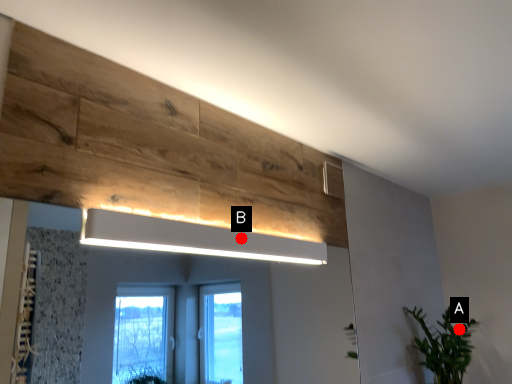
Question: Two points are circled on the image, labeled by A and B beside each circle. Which point appears farthest from the camera in this image?

Choices:
 (A) A is further
 (B) B is further

Answer: (A)